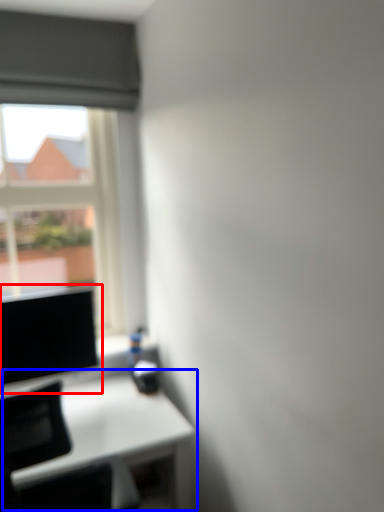
Question: Which object appears closest to the camera in this image, computer screen (highlighted by a red box) or table (highlighted by a blue box)?

Choices:
 (A) computer screen
 (B) table

Answer: (B)